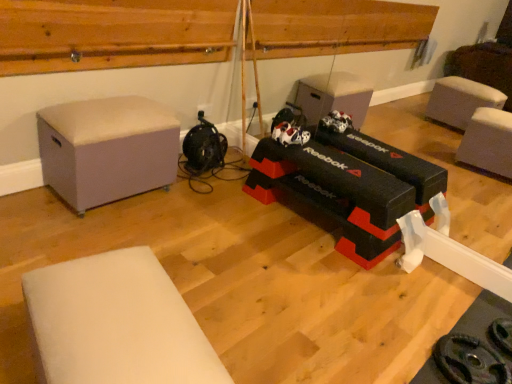
Question: Visually, is light gray fabric ottoman at left, arranged as the first furniture when viewed from the top, positioned to the left or to the right of wooden at upper center?

Choices:
 (A) left
 (B) right

Answer: (A)

Question: Looking at their shapes, would you say light gray fabric ottoman at left, the 1th furniture positioned from the back, is wider or thinner than wooden at upper center?

Choices:
 (A) thin
 (B) wide

Answer: (B)

Question: Based on their relative distances, which object is nearer to the white foam mat at lower left, which is the 1th furniture in front-to-back order?

Choices:
 (A) light gray fabric ottoman at left, which is the 2th furniture from bottom to top
 (B) wooden at upper center

Answer: (A)

Question: Which of these objects is positioned closest to the white foam mat at lower left, the first furniture positioned from the bottom?

Choices:
 (A) wooden at upper center
 (B) light gray fabric ottoman at left, acting as the 2th furniture starting from the front

Answer: (B)